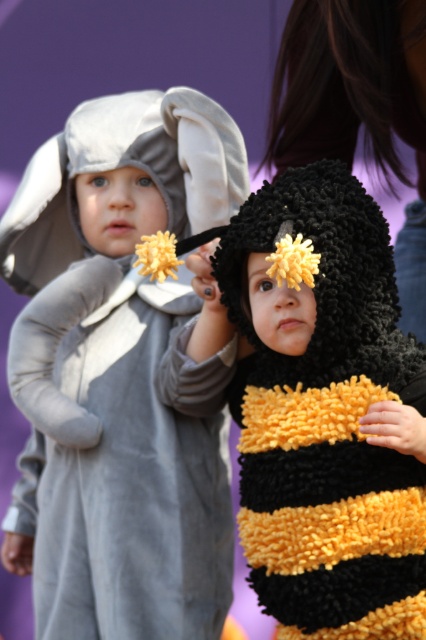
Based on the photo, what is the significance of the point at coordinates (x=120, y=374) in the image?

The point at coordinates (x=120, y=374) marks the location of the velvety gray elephant at left.